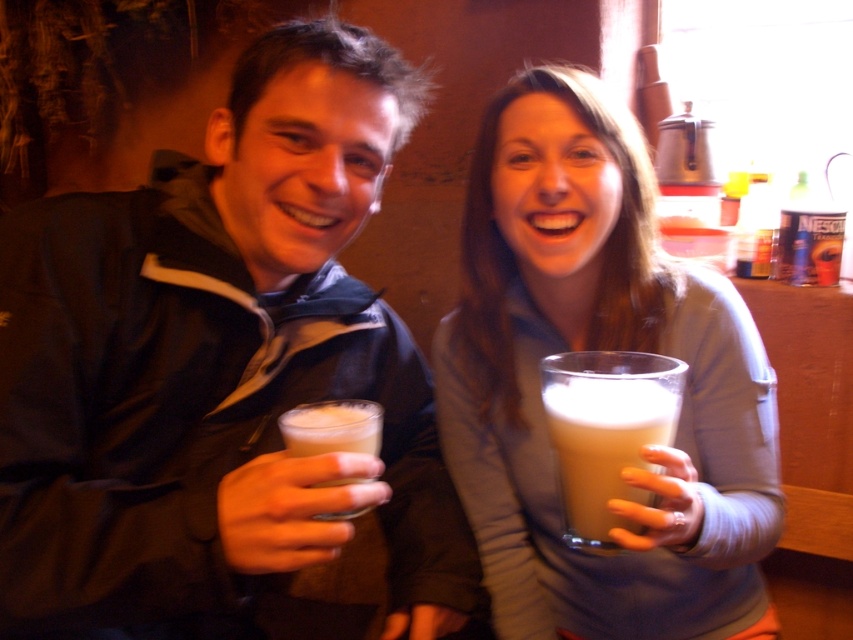
Measure the distance from matte black jacket at center to matte glass mug at center.

matte black jacket at center and matte glass mug at center are 9.08 inches apart from each other.

Which is below, matte black jacket at center or matte glass mug at center?

matte glass mug at center is lower down.

At what (x,y) coordinates should I click in order to perform the action: click on matte black jacket at center. Please return your answer as a coordinate pair (x, y). This screenshot has height=640, width=853. Looking at the image, I should click on (219, 369).

Describe the element at coordinates (219, 369) in the screenshot. The image size is (853, 640). I see `matte black jacket at center` at that location.

Can you confirm if matte black jacket at center is positioned below foamy white liquid at center?

Incorrect, matte black jacket at center is not positioned below foamy white liquid at center.

Who is more forward, (349, 333) or (595, 445)?

Point (595, 445) is in front.

Where is `matte black jacket at center`? matte black jacket at center is located at coordinates (219, 369).

Between matte black jacket at center and white frothy foam at left, which one appears on the left side from the viewer's perspective?

matte black jacket at center

Is matte black jacket at center below white frothy foam at left?

No, matte black jacket at center is not below white frothy foam at left.

Where is `matte black jacket at center`? matte black jacket at center is located at coordinates (219, 369).